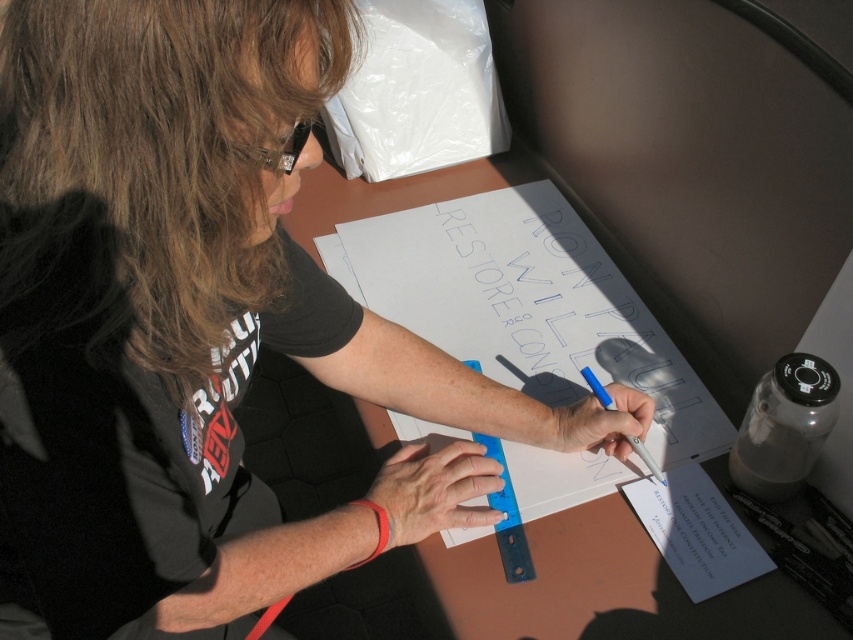
Where is the brown wood table at center located in the image?

The brown wood table at center is located at point [602,588] in the image.

You are a photographer who wants to take a closeup shot of the brown wood table at center. The camera you are using has a minimum focusing distance of 75 centimeters. Can you take the photo without moving the camera or the table?

The brown wood table at center and camera are 76.86 centimeters apart from each other. Since the minimum focusing distance is 75 centimeters, the camera cannot focus because the distance is slightly more than the required minimum. Move the camera closer to the table to take the photo.

You are a photographer trying to capture a closeup of the text on the paper. You have two points marked on the paper at coordinates point (762, 560) and point (637, 436). Which point should you focus on to ensure the text is in sharp focus?

Point (762, 560) is closer to the viewer than point (637, 436), so focusing on point (762, 560) will ensure the text is in sharp focus.